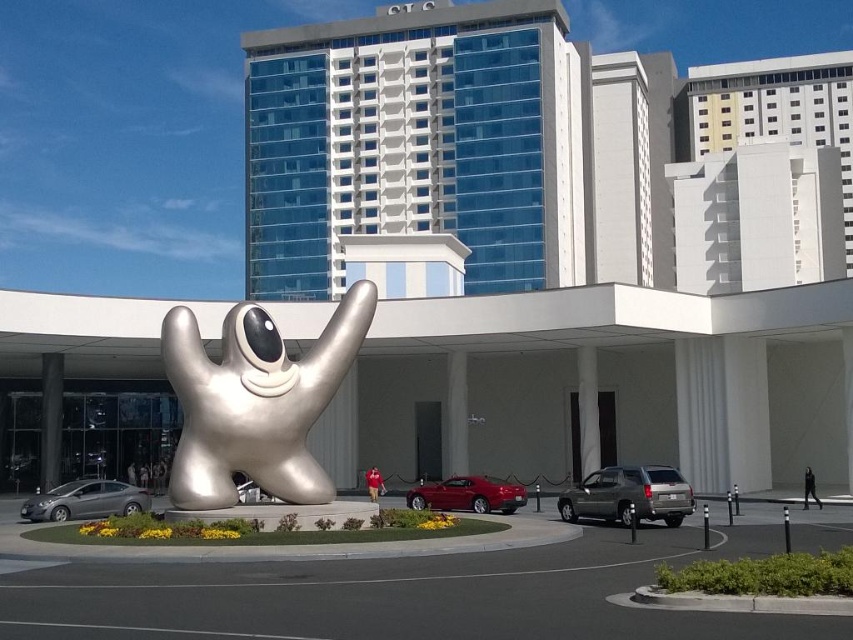
You are a delivery driver who needs to park your vehicle in this area. You see a matte gray suv at center and a silver metallic sedan at lower left. Which vehicle is closer to the right side of the parking space?

The matte gray suv at center is positioned on the right side of the silver metallic sedan at lower left, meaning it is closer to the right side of the parking space.

You are a parking attendant who needs to park a new vehicle that requires a space taller than the matte gray suv at center. Can the glossy red car at center provide enough height clearance for the new vehicle?

The matte gray suv at center is shorter than the glossy red car at center. Therefore, the glossy red car at center has sufficient height clearance for the new vehicle since it is taller than the suv.